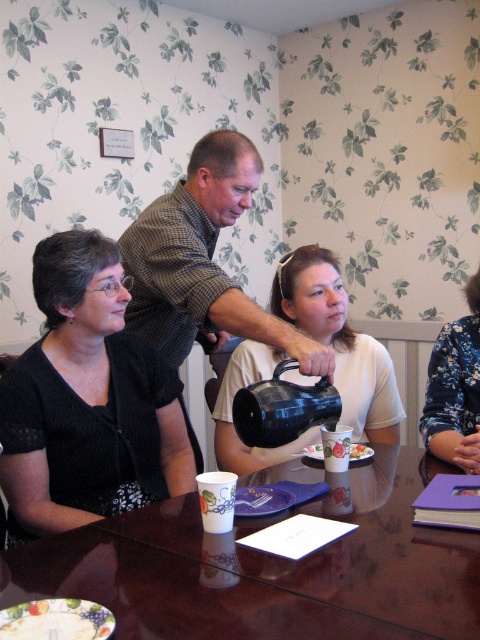
You are planning to place a small decorative item on the glossy plastic table at center and the white paper plate at lower center. Which surface can accommodate a larger item without it falling off?

The glossy plastic table at center can accommodate a larger item without it falling off because it is larger in size than the white paper plate at lower center.

You are setting up a small table for a tea ceremony. You have a matte black teapot at center and a white paper plate at lower center. Which item should you place on the higher shelf if you need to store them vertically?

The matte black teapot at center is taller than the white paper plate at lower center, so you should place the matte black teapot at center on the higher shelf to accommodate its height.